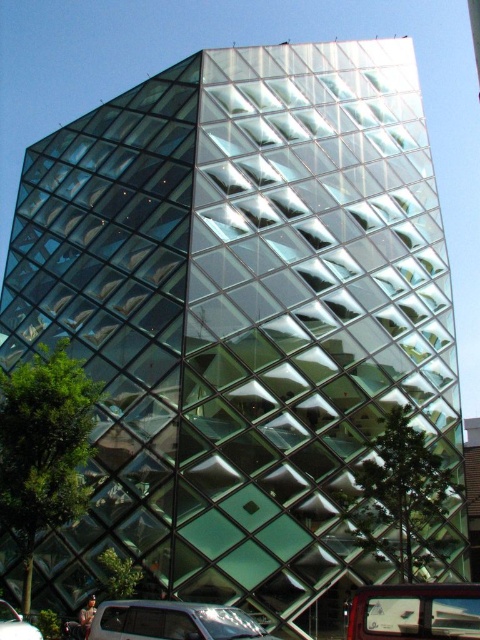
From the picture: Between metallic silver car at lower right and metallic silver car at lower left, which one appears on the left side from the viewer's perspective?

metallic silver car at lower left

Does point (385, 620) come in front of point (0, 637)?

Yes, it is.

This screenshot has width=480, height=640. I want to click on metallic silver car at lower right, so click(x=416, y=611).

Can you confirm if matte silver van at lower center is bigger than metallic silver car at lower left?

No, matte silver van at lower center is not bigger than metallic silver car at lower left.

Between matte silver van at lower center and metallic silver car at lower left, which one has less height?

matte silver van at lower center is shorter.

Image resolution: width=480 pixels, height=640 pixels. I want to click on matte silver van at lower center, so click(x=172, y=621).

Where is `matte silver van at lower center`? The image size is (480, 640). matte silver van at lower center is located at coordinates (172, 621).

Between point (396, 584) and point (168, 632), which one is positioned in front?

Point (168, 632)

Is metallic silver car at lower right further to camera compared to matte silver van at lower center?

No, metallic silver car at lower right is in front of matte silver van at lower center.

The width and height of the screenshot is (480, 640). Find the location of `metallic silver car at lower right`. metallic silver car at lower right is located at coordinates (416, 611).